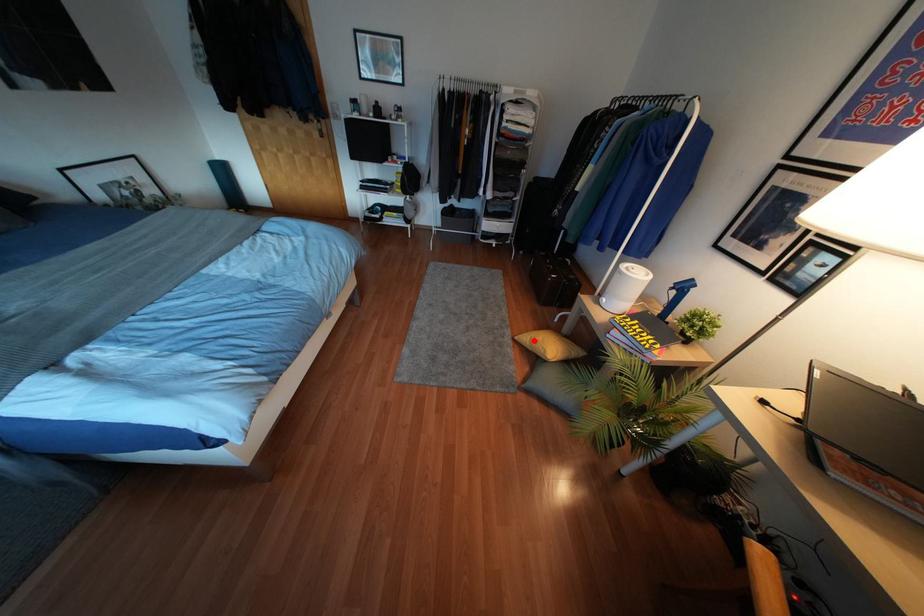
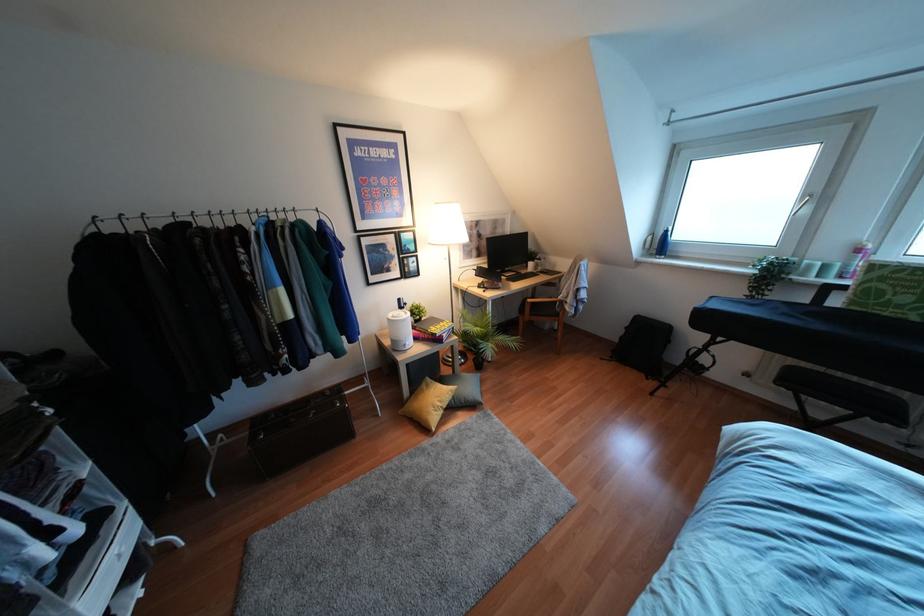
The point at the highlighted location is marked in the first image. Where is the corresponding point in the second image?

(439, 403)